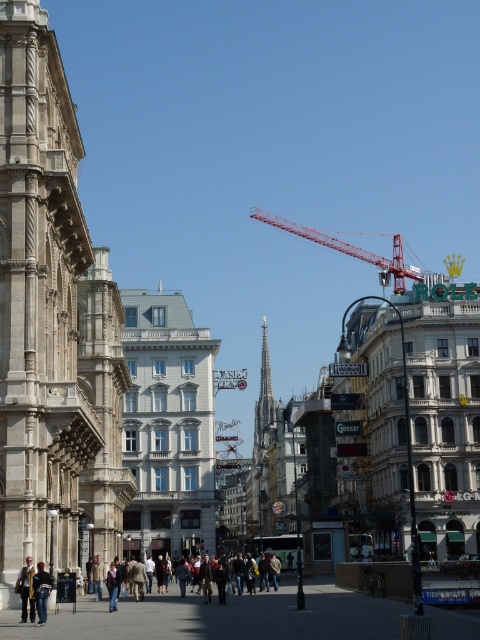
You are a city planner assessing the urban layout. You notice the red metallic crane at upper center and the brown leather jacket at center. Which object is positioned higher in the image?

The red metallic crane at upper center is positioned higher than the brown leather jacket at center.